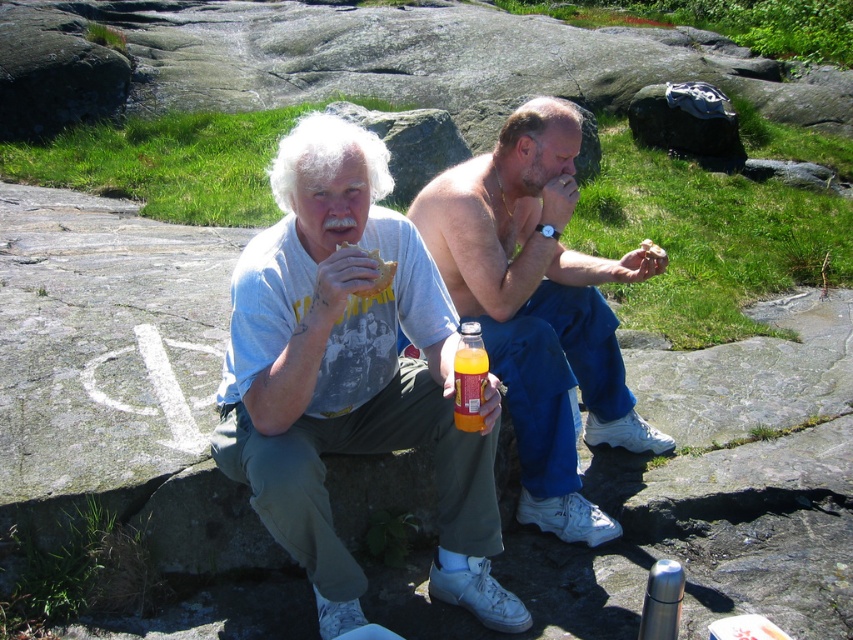
Can you confirm if shiny orange bottle at center is positioned below matte bread at center?

Yes.

How distant is shiny orange bottle at center from matte bread at center?

The distance of shiny orange bottle at center from matte bread at center is 34.72 inches.

Is point (595, 358) less distant than point (384, 285)?

No, it is behind (384, 285).

Identify the location of shiny orange bottle at center. (538, 308).

Who is shorter, orange plastic bottle at center or matte bread at center?

matte bread at center is shorter.

Does orange plastic bottle at center appear on the right side of matte bread at center?

Indeed, orange plastic bottle at center is positioned on the right side of matte bread at center.

Is point (485, 355) in front of point (383, 282)?

Yes, it is in front of point (383, 282).

Identify the location of orange plastic bottle at center. (469, 378).

Which of these two, matte gray t-shirt at center or matte bread at center, stands shorter?

With less height is matte bread at center.

Who is more forward, (x=312, y=554) or (x=393, y=273)?

Positioned in front is point (x=393, y=273).

Describe the element at coordinates (349, 376) in the screenshot. The height and width of the screenshot is (640, 853). I see `matte gray t-shirt at center` at that location.

The image size is (853, 640). I want to click on matte gray t-shirt at center, so click(x=349, y=376).